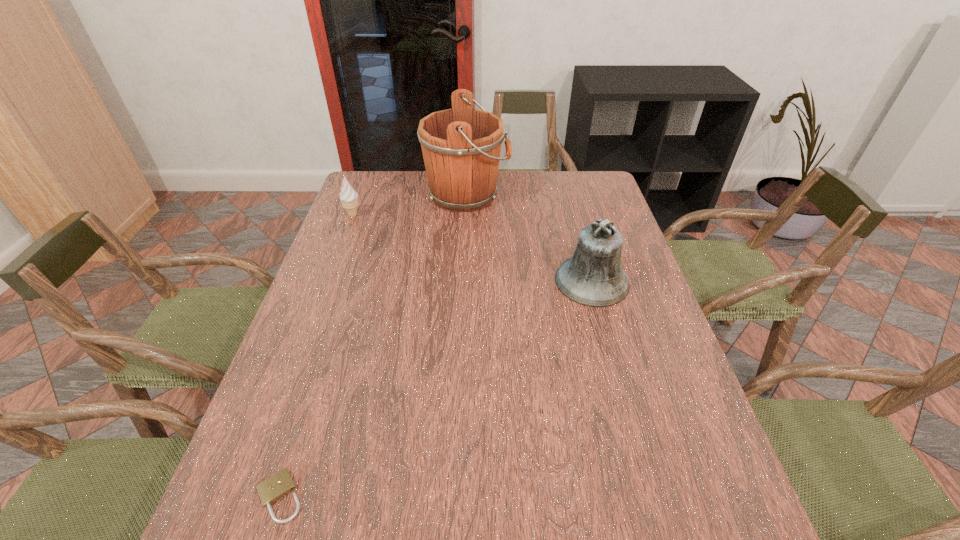
This screenshot has width=960, height=540. Find the location of `object that is the second closest to the icecream`. object that is the second closest to the icecream is located at coordinates (593, 276).

You are a GUI agent. You are given a task and a screenshot of the screen. Output one action in this format:
    pyautogui.click(x=<x>, y=<y>)
    Task: Click on the vacant space that satisfies the following two spatial constraints: 1. on the front-facing side of the third tallest object; 2. on the back side of the nearest object
    The width and height of the screenshot is (960, 540).
    Given the screenshot: What is the action you would take?
    pyautogui.click(x=247, y=496)

Where is `vacant position in the image that satisfies the following two spatial constraints: 1. on the front-facing side of the third tallest object; 2. on the left side of the bell`? vacant position in the image that satisfies the following two spatial constraints: 1. on the front-facing side of the third tallest object; 2. on the left side of the bell is located at coordinates (327, 281).

Find the location of a particular element. vacant space that satisfies the following two spatial constraints: 1. with the handle on the side of the tallest object; 2. on the left side of the second tallest object is located at coordinates (464, 281).

Where is `free space that satisfies the following two spatial constraints: 1. on the back side of the padlock; 2. on the right side of the second nearest object`? The height and width of the screenshot is (540, 960). free space that satisfies the following two spatial constraints: 1. on the back side of the padlock; 2. on the right side of the second nearest object is located at coordinates (349, 281).

Where is `free location that satisfies the following two spatial constraints: 1. on the back side of the third farthest object; 2. with the handle on the side of the second object from right to left`? free location that satisfies the following two spatial constraints: 1. on the back side of the third farthest object; 2. with the handle on the side of the second object from right to left is located at coordinates (567, 195).

Where is `vacant region that satisfies the following two spatial constraints: 1. on the front-facing side of the nearest object; 2. on the right side of the second shortest object`? vacant region that satisfies the following two spatial constraints: 1. on the front-facing side of the nearest object; 2. on the right side of the second shortest object is located at coordinates (247, 496).

This screenshot has height=540, width=960. Find the location of `blank area in the image that satisfies the following two spatial constraints: 1. with the handle on the side of the bucket; 2. on the left side of the second tallest object`. blank area in the image that satisfies the following two spatial constraints: 1. with the handle on the side of the bucket; 2. on the left side of the second tallest object is located at coordinates (464, 281).

This screenshot has width=960, height=540. I want to click on vacant area in the image that satisfies the following two spatial constraints: 1. on the back side of the nearest object; 2. on the left side of the third shortest object, so click(349, 281).